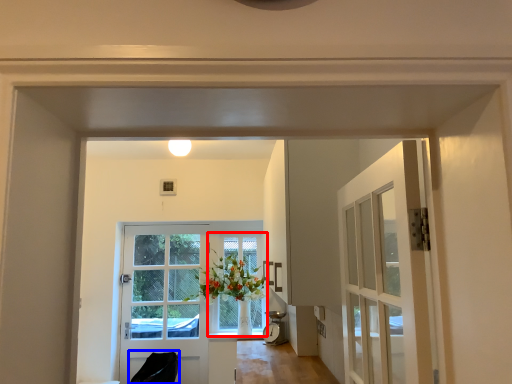
Question: Which object appears farthest to the camera in this image, window (highlighted by a red box) or chair (highlighted by a blue box)?

Choices:
 (A) window
 (B) chair

Answer: (A)